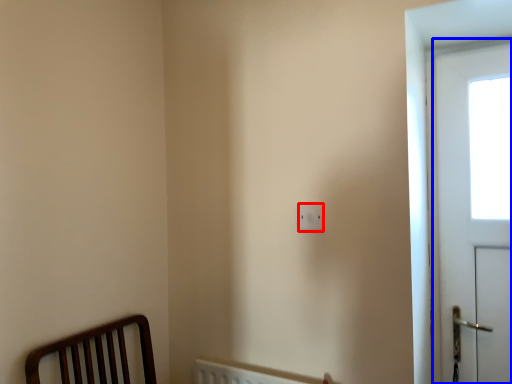
Question: Which of the following is the closest to the observer, light switch (highlighted by a red box) or screen door (highlighted by a blue box)?

Choices:
 (A) light switch
 (B) screen door

Answer: (A)